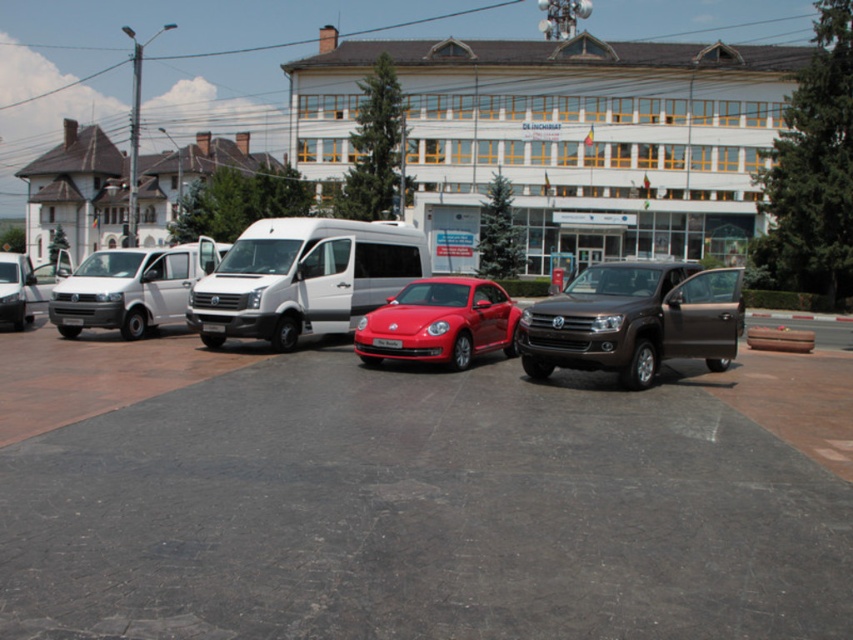
You are a delivery person trying to park your truck next to the satin brown suv at center and the black plastic license plate at center. Since your truck is 2 meters wide, can you park it between them without overlapping?

The satin brown suv at center is narrower than the black plastic license plate at center, but the exact distance between them isn

You are standing at the entrance of the multi story building and want to park your car. You see the white matte van at center and the glossy red car at center. Which vehicle is positioned higher relative to the other?

The white matte van at center is above the glossy red car at center, so it is positioned higher.